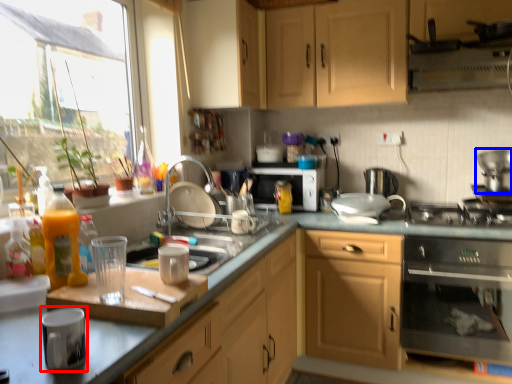
Question: Which object is closer to the camera taking this photo, appliance (highlighted by a red box) or appliance (highlighted by a blue box)?

Choices:
 (A) appliance
 (B) appliance

Answer: (A)